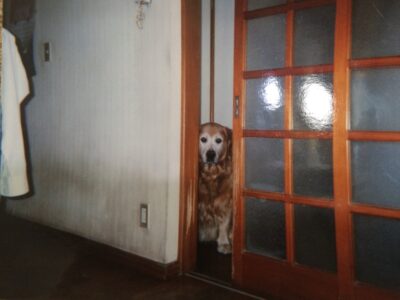
Where is `sliding door track`? sliding door track is located at coordinates (205, 277).